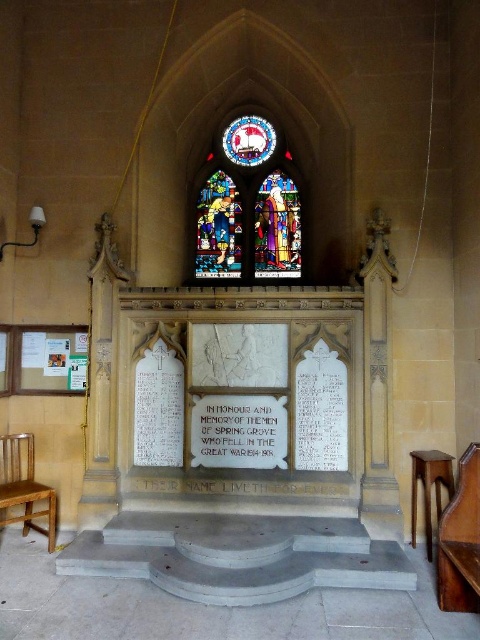
Question: Which point is closer to the camera taking this photo?

Choices:
 (A) pos(215,195)
 (B) pos(248,420)
 (C) pos(12,449)

Answer: (B)

Question: Which point is closer to the camera taking this photo?

Choices:
 (A) (32, 444)
 (B) (259, 452)
 (C) (215, 147)

Answer: (B)

Question: Can you confirm if stained glass window at center is positioned to the right of white paper at center?

Choices:
 (A) no
 (B) yes

Answer: (B)

Question: Among these points, which one is nearest to the camera?

Choices:
 (A) pyautogui.click(x=277, y=403)
 (B) pyautogui.click(x=56, y=516)

Answer: (A)

Question: Does stained glass window at center have a smaller size compared to white paper at center?

Choices:
 (A) yes
 (B) no

Answer: (B)

Question: Can you confirm if white paper at center is positioned to the left of wooden chair at left?

Choices:
 (A) yes
 (B) no

Answer: (B)